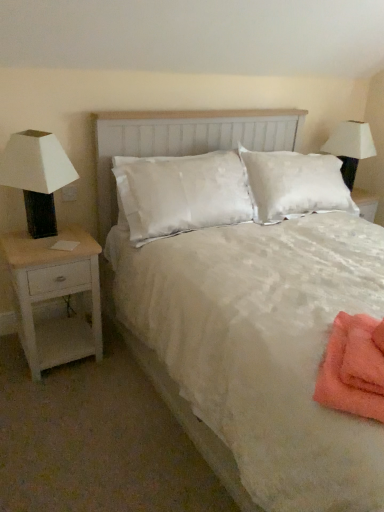
Where is `vacant area that lies to the right of white wood nightstand at left`? vacant area that lies to the right of white wood nightstand at left is located at coordinates (119, 369).